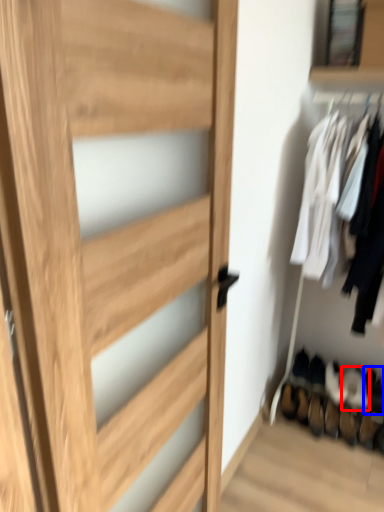
Question: Which object appears closest to the camera in this image, shoe (highlighted by a red box) or shoe (highlighted by a blue box)?

Choices:
 (A) shoe
 (B) shoe

Answer: (A)